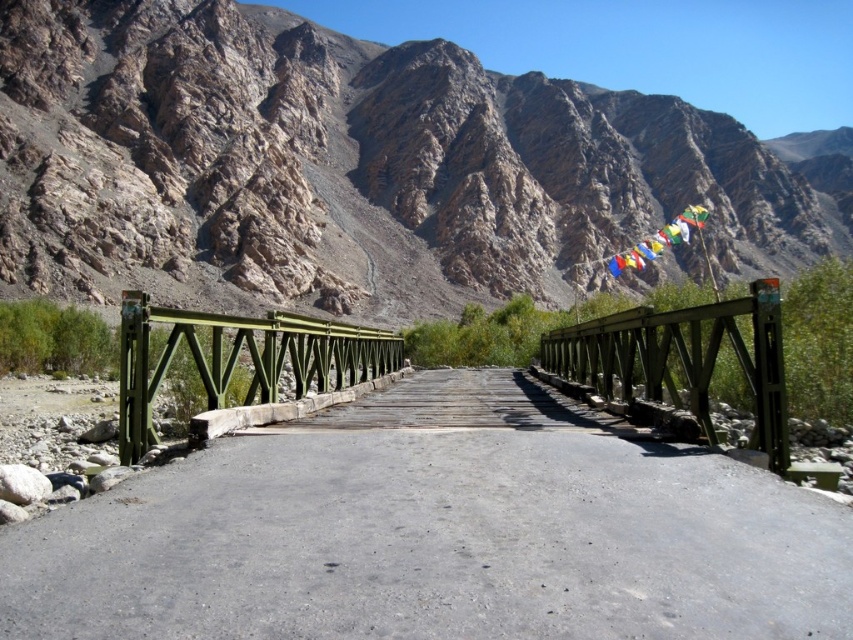
Which is more to the right, green wooden bridge at upper center or green metallic bridge at center?

From the viewer's perspective, green wooden bridge at upper center appears more on the right side.

Who is positioned more to the left, green wooden bridge at upper center or green metallic bridge at center?

green metallic bridge at center is more to the left.

Is point (592, 355) positioned before point (373, 368)?

Yes, it is.

This screenshot has width=853, height=640. Find the location of `green wooden bridge at upper center`. green wooden bridge at upper center is located at coordinates (682, 358).

Can you confirm if smooth concrete bridge at center is thinner than green metallic bridge at center?

Indeed, smooth concrete bridge at center has a lesser width compared to green metallic bridge at center.

Does point (381, 604) lie in front of point (148, 388)?

Yes, point (381, 604) is closer to viewer.

Which is behind, point (582, 515) or point (128, 305)?

Positioned behind is point (128, 305).

In order to click on smooth concrete bridge at center in this screenshot , I will do `click(437, 532)`.

Which is more to the right, rugged stone mountain at upper center or green wooden bridge at upper center?

From the viewer's perspective, rugged stone mountain at upper center appears more on the right side.

Between point (393, 64) and point (654, 381), which one is positioned in front?

Point (654, 381) is more forward.

Measure the distance between point (430,99) and camera.

Point (430,99) and camera are 227.47 meters apart from each other.

Find the location of a particular element. The image size is (853, 640). rugged stone mountain at upper center is located at coordinates (352, 168).